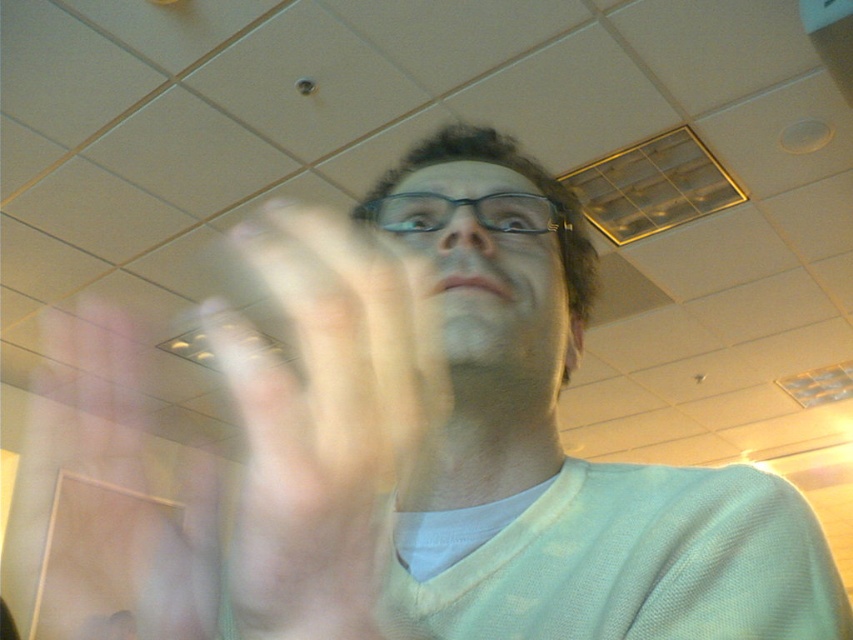
Does light green sweater at center appear under translucent flesh at center?

Actually, light green sweater at center is above translucent flesh at center.

Consider the image. Who is positioned more to the left, light green sweater at center or translucent flesh at center?

translucent flesh at center is more to the left.

Between point (500, 445) and point (328, 352), which one is positioned behind?

Point (500, 445)

Find the location of a particular element. light green sweater at center is located at coordinates (570, 461).

Can you confirm if light green sweater at center is thinner than transparent plastic glasses at center?

No, light green sweater at center is not thinner than transparent plastic glasses at center.

Is point (738, 572) closer to viewer compared to point (445, 218)?

Yes, it is.

Locate an element on the screen. light green sweater at center is located at coordinates (570, 461).

Who is more forward, (543, 301) or (395, 198)?

Point (543, 301) is more forward.

Describe the element at coordinates (486, 248) in the screenshot. I see `matte black glasses at center` at that location.

Locate an element on the screen. matte black glasses at center is located at coordinates (486, 248).